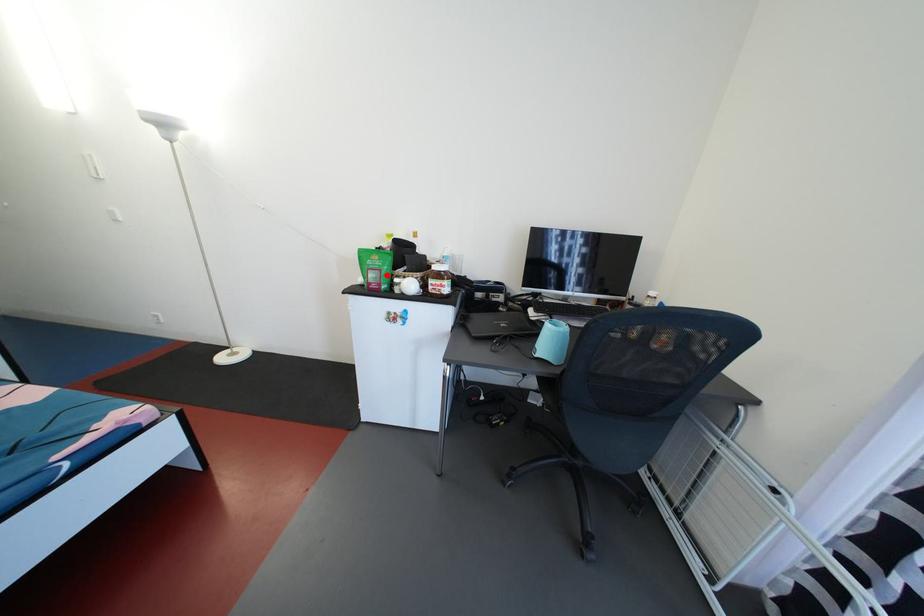
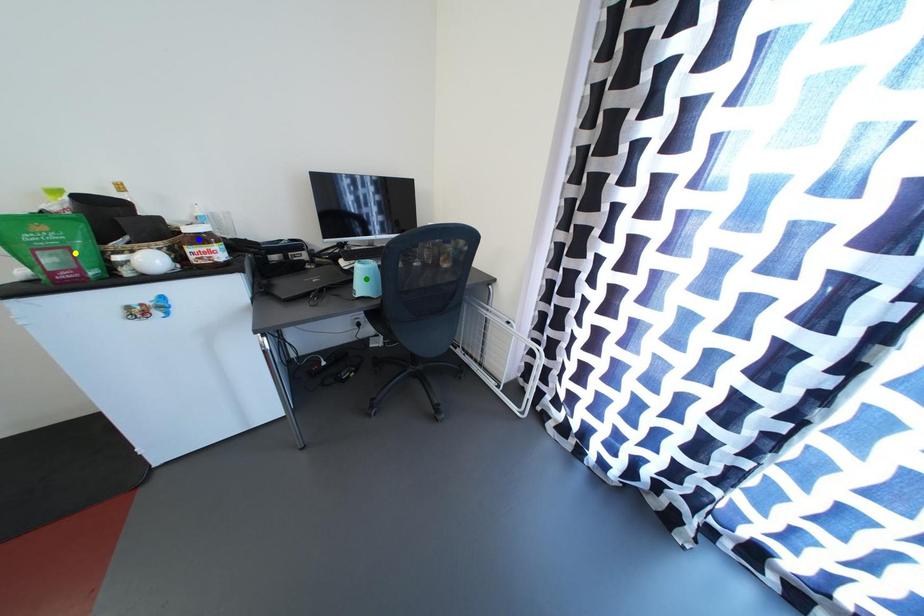
Question: I am providing you with two images of the same scene from different viewpoints. A red point is marked on the first image. You are given multiple points on the second image. Which point in image 2 is actually the same real-world point as the red point in image 1?

Choices:
 (A) blue point
 (B) yellow point
 (C) green point

Answer: (B)